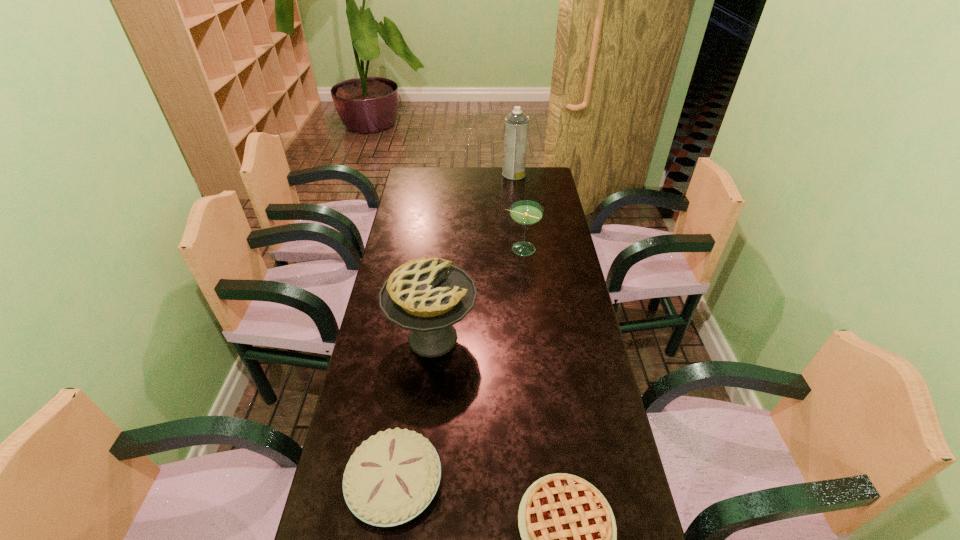
Locate an element on the screen. Image resolution: width=960 pixels, height=540 pixels. aerosol can is located at coordinates (516, 124).

Locate an element on the screen. Image resolution: width=960 pixels, height=540 pixels. the tallest object is located at coordinates (516, 124).

Find the location of a particular element. Image resolution: width=960 pixels, height=540 pixels. the second tallest object is located at coordinates (428, 296).

I want to click on the farthest pie, so click(x=428, y=296).

Image resolution: width=960 pixels, height=540 pixels. In order to click on the second farthest object in this screenshot , I will do `click(525, 212)`.

Image resolution: width=960 pixels, height=540 pixels. What are the coordinates of `martini` in the screenshot? It's located at (525, 212).

Find the location of `the fourth tallest object`. the fourth tallest object is located at coordinates (392, 477).

At what (x,y) coordinates should I click in order to perform the action: click on vacant space located on the left of the aerosol can. Please return your answer as a coordinate pair (x, y). Looking at the image, I should click on (464, 174).

Find the location of a particular element. Image resolution: width=960 pixels, height=540 pixels. free spot located on the cut side of the fourth shortest object is located at coordinates (499, 338).

What are the coordinates of `vacant space situated on the front of the martini` in the screenshot? It's located at (530, 334).